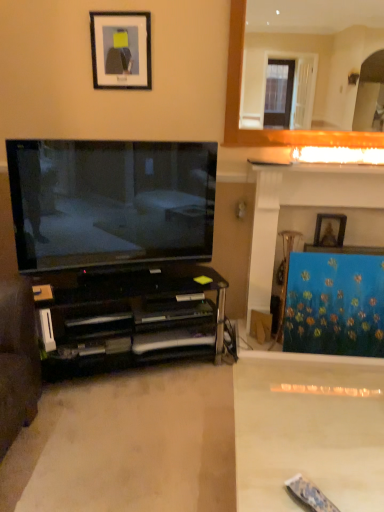
Question: Is white glossy plain at lower right positioned beyond the bounds of matte black tv at left?

Choices:
 (A) yes
 (B) no

Answer: (A)

Question: Does white glossy plain at lower right have a greater width compared to matte black tv at left?

Choices:
 (A) yes
 (B) no

Answer: (A)

Question: Could you tell me if white glossy plain at lower right is turned towards matte black tv at left?

Choices:
 (A) yes
 (B) no

Answer: (B)

Question: Can you confirm if white glossy plain at lower right is taller than matte black tv at left?

Choices:
 (A) yes
 (B) no

Answer: (B)

Question: Can you confirm if white glossy plain at lower right is bigger than matte black tv at left?

Choices:
 (A) no
 (B) yes

Answer: (B)

Question: Considering the relative positions of white glossy plain at lower right and matte black tv at left in the image provided, is white glossy plain at lower right to the left of matte black tv at left from the viewer's perspective?

Choices:
 (A) yes
 (B) no

Answer: (B)

Question: Can you confirm if black glass cabinet at left is taller than white marble fireplace at upper right?

Choices:
 (A) yes
 (B) no

Answer: (B)

Question: From the image's perspective, does black glass cabinet at left appear higher than white marble fireplace at upper right?

Choices:
 (A) yes
 (B) no

Answer: (B)

Question: Considering the relative sizes of black glass cabinet at left and white marble fireplace at upper right in the image provided, is black glass cabinet at left shorter than white marble fireplace at upper right?

Choices:
 (A) no
 (B) yes

Answer: (B)

Question: Is black glass cabinet at left touching white marble fireplace at upper right?

Choices:
 (A) yes
 (B) no

Answer: (B)

Question: From a real-world perspective, is black glass cabinet at left under white marble fireplace at upper right?

Choices:
 (A) yes
 (B) no

Answer: (A)

Question: Is black glass cabinet at left closer to camera compared to white marble fireplace at upper right?

Choices:
 (A) yes
 (B) no

Answer: (A)

Question: Is black matte picture frame at upper center, which is the second picture frame from back to front, next to blue textured curtain at right?

Choices:
 (A) no
 (B) yes

Answer: (A)